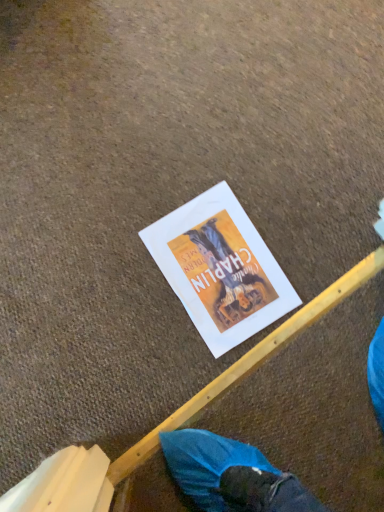
Locate an element on the screen. Image resolution: width=384 pixels, height=512 pixels. empty space that is ontop of matte paper flyer at center (from a real-world perspective) is located at coordinates (220, 267).